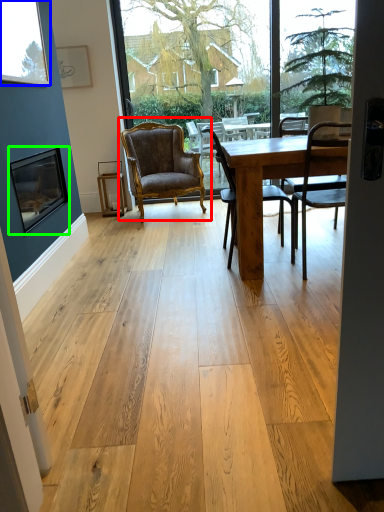
Question: Estimate the real-world distances between objects in this image. Which object is farther from chair (highlighted by a red box), window (highlighted by a blue box) or picture frame (highlighted by a green box)?

Choices:
 (A) window
 (B) picture frame

Answer: (A)